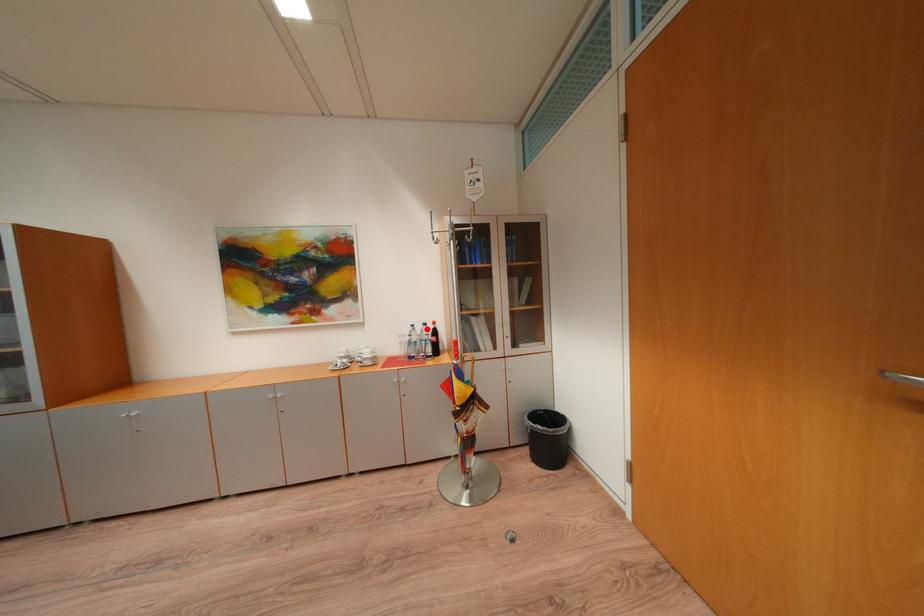
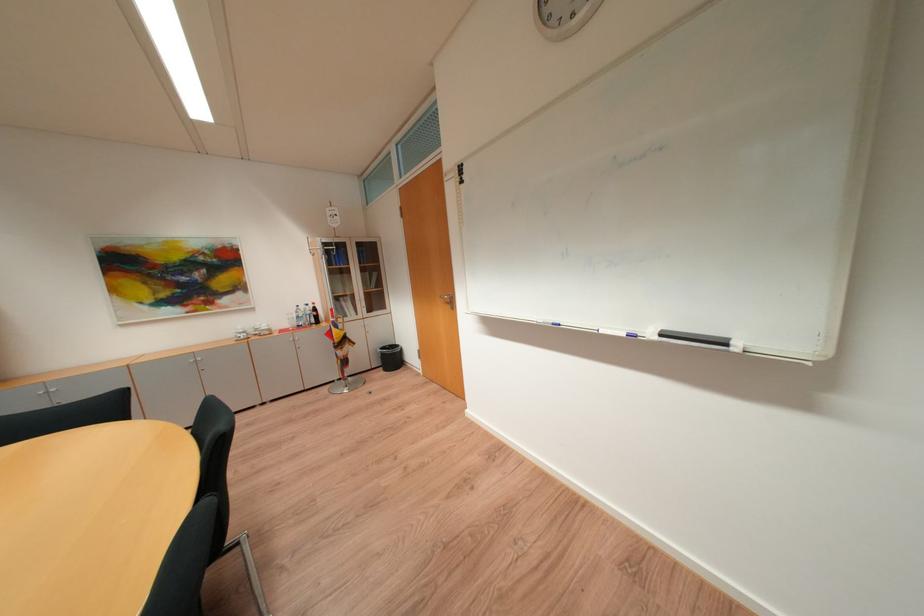
Where in the second image is the point corresponding to the highlighted location from the first image?

(310, 309)